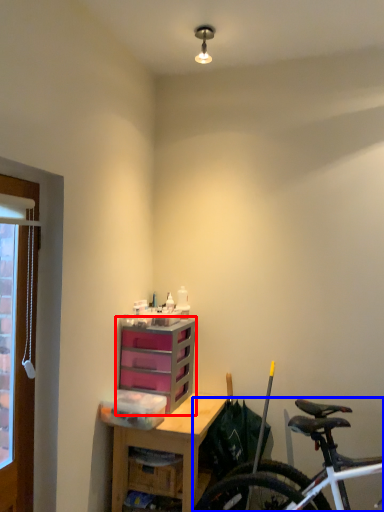
Question: Which of the following is the farthest to the observer, chest of drawers (highlighted by a red box) or bicycle (highlighted by a blue box)?

Choices:
 (A) chest of drawers
 (B) bicycle

Answer: (A)